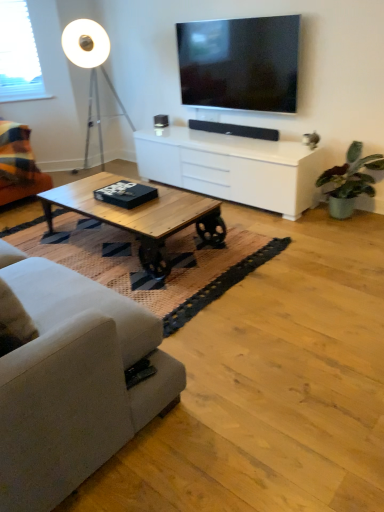
The width and height of the screenshot is (384, 512). What do you see at coordinates (141, 216) in the screenshot?
I see `woodenmaterial/texturecoffee table at center` at bounding box center [141, 216].

You are a GUI agent. You are given a task and a screenshot of the screen. Output one action in this format:
    pyautogui.click(x=<x>, y=<y>)
    Task: Click on the green matte plant at right
    This screenshot has width=384, height=512.
    Given the screenshot: What is the action you would take?
    point(350,180)

What do you see at coordinates (140, 266) in the screenshot? The width and height of the screenshot is (384, 512). I see `wooden at center` at bounding box center [140, 266].

What do you see at coordinates (240, 63) in the screenshot? Image resolution: width=384 pixels, height=512 pixels. I see `flat screen tv at upper center` at bounding box center [240, 63].

Measure the distance between point (75,54) and camera.

Point (75,54) is 3.99 meters away from camera.

Identify the location of white glossy cabinet at center. The height and width of the screenshot is (512, 384). (232, 168).

Is point (51, 486) in front of point (14, 72)?

That is True.

Does light gray fabric couch at left, placed as the first studio couch when sorted from front to back, have a lesser width compared to white plastic window screen at upper left?

No.

In the scene shown: Would you say light gray fabric couch at left, which is counted as the 2th studio couch, starting from the back, is inside or outside white plastic window screen at upper left?

light gray fabric couch at left, which is counted as the 2th studio couch, starting from the back, is located beyond the bounds of white plastic window screen at upper left.

Considering the relative sizes of light gray fabric couch at left, the 1th studio couch in the bottom-to-top sequence, and white plastic window screen at upper left in the image provided, is light gray fabric couch at left, the 1th studio couch in the bottom-to-top sequence, smaller than white plastic window screen at upper left?

No, light gray fabric couch at left, the 1th studio couch in the bottom-to-top sequence, is not smaller than white plastic window screen at upper left.

From a real-world perspective, count 2nd studio couchs downward from the flat screen tv at upper center and point to it. Please provide its 2D coordinates.

[(18, 165)]

Consider the image. From the image's perspective, is plaid fabric couch at left, acting as the second studio couch starting from the front, above or below flat screen tv at upper center?

plaid fabric couch at left, acting as the second studio couch starting from the front, is below flat screen tv at upper center.

From a real-world perspective, between plaid fabric couch at left, which appears as the first studio couch when viewed from the top, and flat screen tv at upper center, who is vertically lower?

plaid fabric couch at left, which appears as the first studio couch when viewed from the top, is physically lower.

Looking at the image, does plaid fabric couch at left, which appears as the first studio couch when viewed from the top, seem bigger or smaller compared to flat screen tv at upper center?

plaid fabric couch at left, which appears as the first studio couch when viewed from the top, is bigger than flat screen tv at upper center.

How distant is woodenmaterial/texturecoffee table at center from white matte floor lamp at upper left?

woodenmaterial/texturecoffee table at center and white matte floor lamp at upper left are 1.82 meters apart.

From a real-world perspective, between woodenmaterial/texturecoffee table at center and white matte floor lamp at upper left, who is vertically higher?

In real-world perspective, white matte floor lamp at upper left is above.

Which point is more distant from viewer, (96, 185) or (95, 90)?

Point (95, 90)

Which is closer to the camera, (44, 415) or (50, 203)?

Point (44, 415) appears to be closer to the viewer than point (50, 203).

How many degrees apart are the facing directions of light gray fabric couch at left, which is counted as the 2th studio couch, starting from the back, and woodenmaterial/texturecoffee table at center?

180 degrees separate the facing orientations of light gray fabric couch at left, which is counted as the 2th studio couch, starting from the back, and woodenmaterial/texturecoffee table at center.

Considering the relative positions of light gray fabric couch at left, marked as the 2th studio couch in a top-to-bottom arrangement, and woodenmaterial/texturecoffee table at center in the image provided, is light gray fabric couch at left, marked as the 2th studio couch in a top-to-bottom arrangement, to the right of woodenmaterial/texturecoffee table at center from the viewer's perspective?

In fact, light gray fabric couch at left, marked as the 2th studio couch in a top-to-bottom arrangement, is to the left of woodenmaterial/texturecoffee table at center.

How distant is light gray fabric couch at left, placed as the first studio couch when sorted from front to back, from woodenmaterial/texturecoffee table at center?

light gray fabric couch at left, placed as the first studio couch when sorted from front to back, is 3.34 feet away from woodenmaterial/texturecoffee table at center.

Does flat screen tv at upper center have a greater width compared to white glossy cabinet at center?

Incorrect, the width of flat screen tv at upper center does not surpass that of white glossy cabinet at center.

Considering the relative positions of flat screen tv at upper center and white glossy cabinet at center in the image provided, is flat screen tv at upper center to the left of white glossy cabinet at center from the viewer's perspective?

In fact, flat screen tv at upper center is to the right of white glossy cabinet at center.

The width and height of the screenshot is (384, 512). Find the location of `television on the right of white glossy cabinet at center`. television on the right of white glossy cabinet at center is located at coordinates (240, 63).

Is flat screen tv at upper center positioned before white glossy cabinet at center?

No, flat screen tv at upper center is further to the viewer.

Is white plastic window screen at upper left facing away from plaid fabric couch at left, which appears as the first studio couch when viewed from the top?

No, white plastic window screen at upper left is not facing the opposite direction of plaid fabric couch at left, which appears as the first studio couch when viewed from the top.

Are white plastic window screen at upper left and plaid fabric couch at left, acting as the second studio couch starting from the front, making contact?

No, white plastic window screen at upper left is not beside plaid fabric couch at left, acting as the second studio couch starting from the front.

Based on the photo, from a real-world perspective, which object rests below the other?

From a 3D spatial view, plaid fabric couch at left, which is the 2th studio couch from bottom to top, is below.

At what (x,y) coordinates should I click in order to perform the action: click on window screen located on the left of plaid fabric couch at left, which is the 2th studio couch from bottom to top. Please return your answer as a coordinate pair (x, y). Image resolution: width=384 pixels, height=512 pixels. Looking at the image, I should click on (18, 55).

Are plaid fabric couch at left, which is the 2th studio couch from bottom to top, and green matte plant at right far apart?

Yes, plaid fabric couch at left, which is the 2th studio couch from bottom to top, is far from green matte plant at right.

Could you measure the distance between plaid fabric couch at left, the 1th studio couch viewed from the back, and green matte plant at right?

The distance of plaid fabric couch at left, the 1th studio couch viewed from the back, from green matte plant at right is 2.53 meters.

From a real-world perspective, count 1st studio couchs upward from the green matte plant at right and point to it. Please provide its 2D coordinates.

[(18, 165)]

Where is `the 2nd studio couch in front of the white plastic window screen at upper left, counting from the anchor's position`? This screenshot has height=512, width=384. the 2nd studio couch in front of the white plastic window screen at upper left, counting from the anchor's position is located at coordinates (72, 382).

Locate an element on the screen. The width and height of the screenshot is (384, 512). studio couch that is the 1st object located below the flat screen tv at upper center (from the image's perspective) is located at coordinates (18, 165).

Estimate the real-world distances between objects in this image. Which object is closer to white plastic window screen at upper left, green matte plant at right or woodenmaterial/texturecoffee table at center?

woodenmaterial/texturecoffee table at center is positioned closer to the anchor white plastic window screen at upper left.

Looking at the image, which one is located further to woodenmaterial/texturecoffee table at center, white plastic window screen at upper left or white glossy cabinet at center?

white plastic window screen at upper left lies further to woodenmaterial/texturecoffee table at center than the other object.

When comparing their distances from woodenmaterial/texturecoffee table at center, does white glossy cabinet at center or flat screen tv at upper center seem further?

Among the two, flat screen tv at upper center is located further to woodenmaterial/texturecoffee table at center.

From the image, which object appears to be nearer to plaid fabric couch at left, which appears as the first studio couch when viewed from the top, flat screen tv at upper center or white glossy cabinet at center?

Based on the image, white glossy cabinet at center appears to be nearer to plaid fabric couch at left, which appears as the first studio couch when viewed from the top.

When comparing their distances from green matte plant at right, does plaid fabric couch at left, the 1th studio couch viewed from the back, or flat screen tv at upper center seem further?

plaid fabric couch at left, the 1th studio couch viewed from the back.

Considering their positions, is woodenmaterial/texturecoffee table at center positioned closer to light gray fabric couch at left, placed as the first studio couch when sorted from front to back, than plaid fabric couch at left, which appears as the first studio couch when viewed from the top?

woodenmaterial/texturecoffee table at center is positioned closer to the anchor light gray fabric couch at left, placed as the first studio couch when sorted from front to back.

From the picture: When comparing their distances from wooden at center, does plaid fabric couch at left, which is the 2th studio couch from bottom to top, or light gray fabric couch at left, the 1th studio couch in the bottom-to-top sequence, seem closer?

light gray fabric couch at left, the 1th studio couch in the bottom-to-top sequence, is closer to wooden at center.

Considering their positions, is flat screen tv at upper center positioned further to white glossy cabinet at center than green matte plant at right?

The object further to white glossy cabinet at center is flat screen tv at upper center.

This screenshot has height=512, width=384. I want to click on television between woodenmaterial/texturecoffee table at center and green matte plant at right from left to right, so click(240, 63).

In order to click on cabinetry between light gray fabric couch at left, marked as the 2th studio couch in a top-to-bottom arrangement, and white plastic window screen at upper left in the front-back direction in this screenshot , I will do `click(232, 168)`.

Where is `lamp between light gray fabric couch at left, placed as the first studio couch when sorted from front to back, and white plastic window screen at upper left, along the z-axis`? The height and width of the screenshot is (512, 384). lamp between light gray fabric couch at left, placed as the first studio couch when sorted from front to back, and white plastic window screen at upper left, along the z-axis is located at coordinates (91, 68).

Find the location of a particular element. Image resolution: width=384 pixels, height=512 pixels. lamp located between plaid fabric couch at left, which appears as the first studio couch when viewed from the top, and woodenmaterial/texturecoffee table at center in the left-right direction is located at coordinates (91, 68).